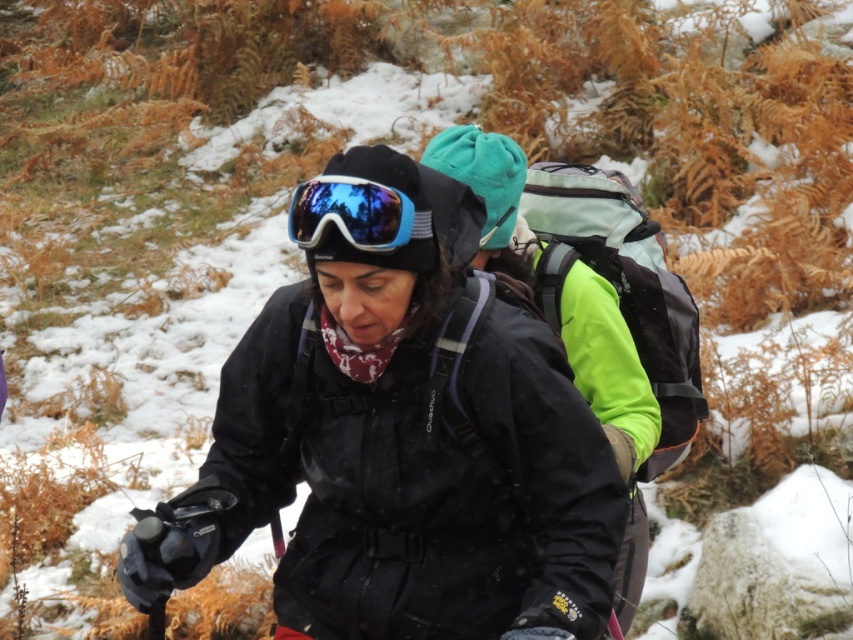
You are a photographer trying to capture a closeup of the shiny blue ski goggles at center. The matte black jacket at center is blocking your view. Can you move around to the left side to get a clear shot without the jacket blocking?

The matte black jacket at center is closer to the viewer than the shiny blue ski goggles at center, so moving to the left side might not help because the jacket is still between you and the goggles. You might need to move around to the right side instead.

You are using a coordinate system where the bottom left corner of the image is the origin point. The coordinates are given as a tuple of two decimals between 0 and 1. The first number is the horizontal axis, and the second is the vertical axis. The image has a resolution of 1920x1080 pixels. The person wearing the matte black jacket at center is standing at coordinates approximately where?

The matte black jacket at center is located at coordinates approximately 0.702 on the horizontal axis and 0.472 on the vertical axis.